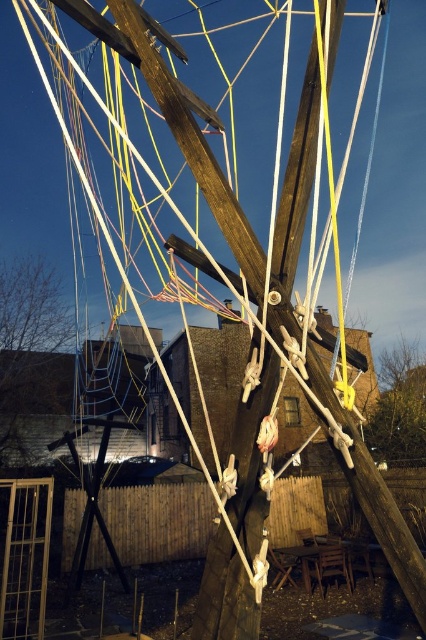
You are standing in the middle of the obstacle course and see the green matte tree at lower left and the wooden swing at right. Which object would you need to look up at to see?

The wooden swing at right is taller than the green matte tree at lower left, so you would need to look up at the wooden swing at right.

You are standing in the obstacle course area and see the green matte tree at lower left and the wooden swing at right. Which object is positioned higher in the scene?

The green matte tree at lower left is located above the wooden swing at right, so it is positioned higher in the scene.

From the picture: You are standing in front of the wooden obstacle course structure at night. You notice two points marked on the ropes. The first is at coordinates point (23, 340) and the second is at point (423, 419). Which point is closer to you?

Point (23, 340) is further to the camera than point (423, 419). Therefore, the point closer to you is point (423, 419).